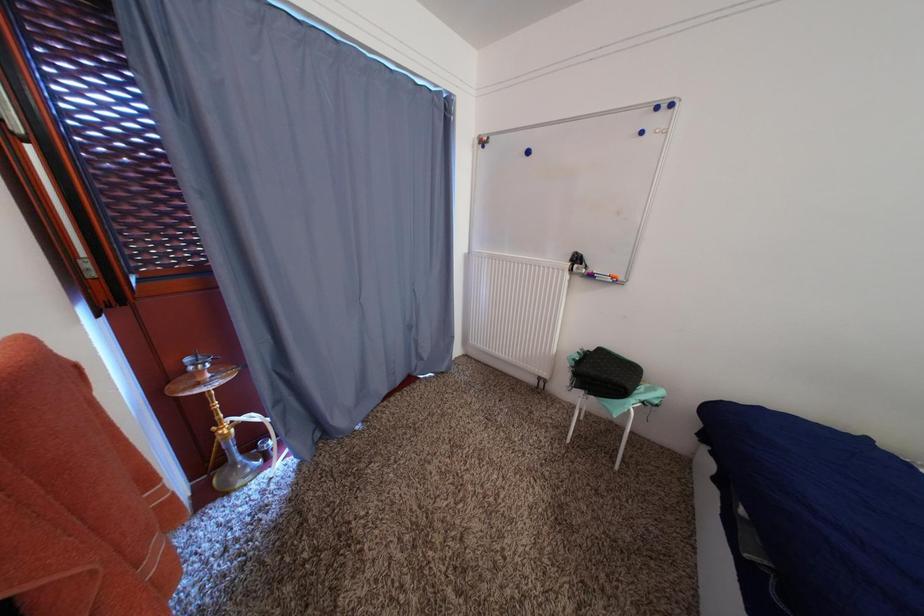
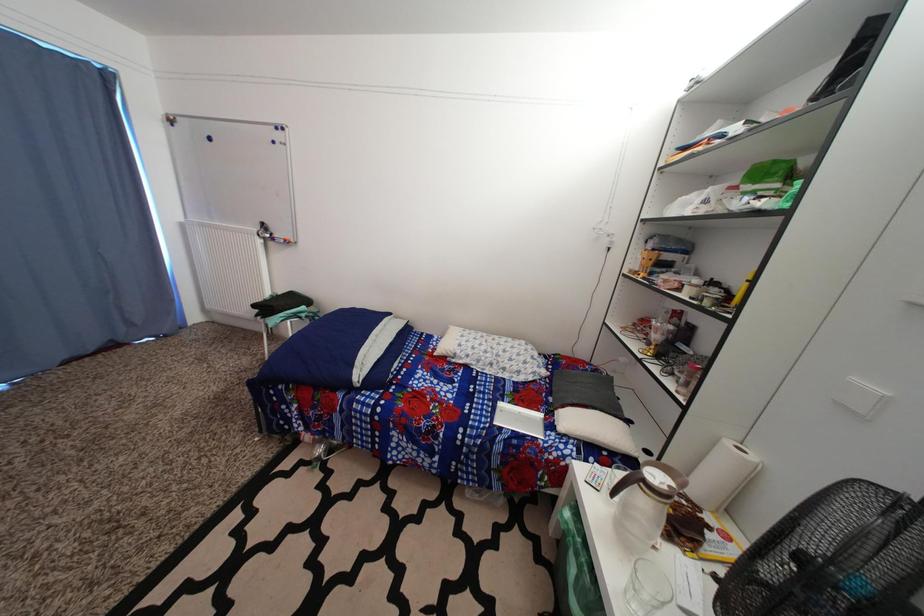
Based on the photo, in a continuous first-person perspective shot, in which direction is the camera moving?

The cameraman walked toward right, backward.